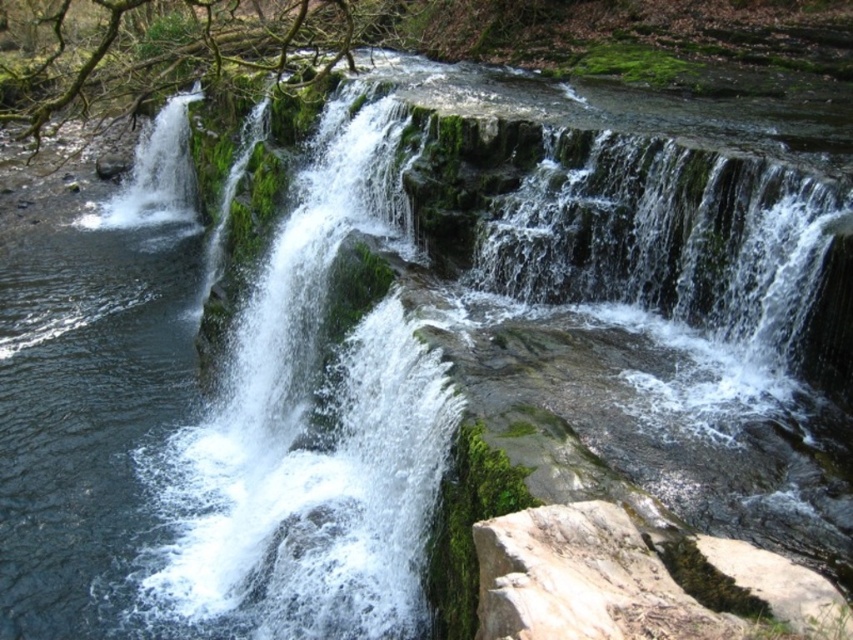
Is white frothy water at left smaller than gray rough rock at lower right?

No.

In the scene shown: Between white frothy water at left and gray rough rock at lower right, which one has less height?

Standing shorter between the two is gray rough rock at lower right.

Image resolution: width=853 pixels, height=640 pixels. Identify the location of white frothy water at left. (309, 428).